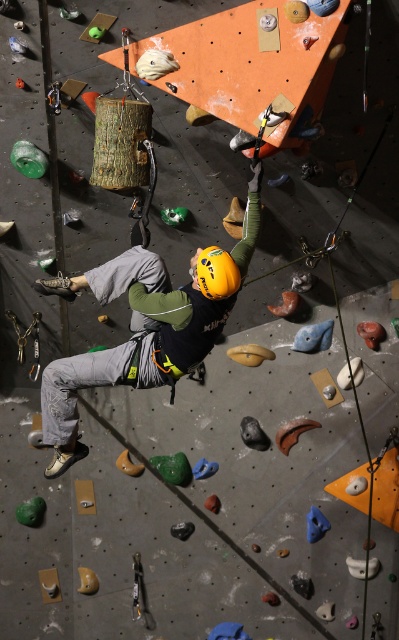
You are a safety inspector checking the climbing gear. You notice two helmets labeled as the same model but see a size difference between the matte yellow helmet at center and the yellow matte helmet at center. Which one should you recommend for a climber needing a larger size?

The matte yellow helmet at center is bigger than the yellow matte helmet at center, so you should recommend the matte yellow helmet at center for a climber needing a larger size.

You are a safety inspector checking the equipment in the climbing gym. You notice two yellow helmets labeled as the same model, the matte yellow helmet at center and the yellow matte helmet at center. According to the safety guidelines, helmets must have a minimum width of 25 cm. Which helmet meets the requirement?

The matte yellow helmet at center has a larger width than the yellow matte helmet at center, so it meets the minimum width requirement of 25 cm if its width is at least 25 cm. However, without specific measurements, we cannot confirm compliance. Please measure both helmets to ensure they meet the safety standard.